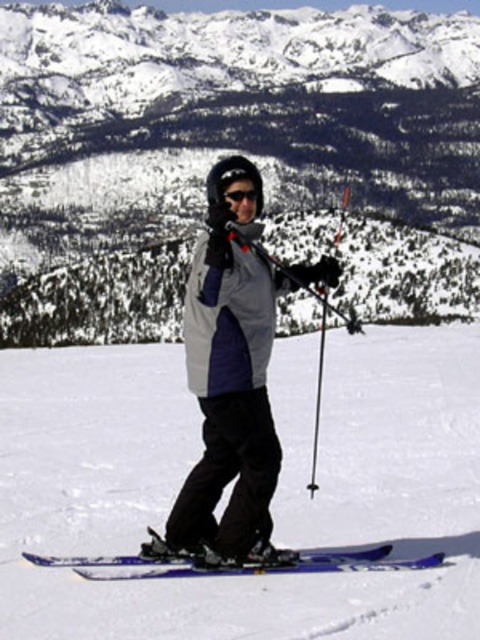
Is blue metallic skis at center shorter than black matte goggles at center?

Incorrect, blue metallic skis at center's height does not fall short of black matte goggles at center's.

This screenshot has width=480, height=640. Describe the element at coordinates (274, 497) in the screenshot. I see `blue metallic skis at center` at that location.

This screenshot has height=640, width=480. In order to click on blue metallic skis at center in this screenshot , I will do (274, 497).

Which is behind, point (420, 547) or point (103, 561)?

The point (420, 547) is more distant.

Does point (386, 348) lie behind point (328, 557)?

Yes, point (386, 348) is behind point (328, 557).

Is point (196, 611) more distant than point (208, 572)?

No, (196, 611) is closer to viewer.

At what (x,y) coordinates should I click in order to perform the action: click on blue metallic skis at center. Please return your answer as a coordinate pair (x, y). This screenshot has width=480, height=640. Looking at the image, I should click on (274, 497).

Can you confirm if blue metallic skis at lower center is thinner than black matte goggles at center?

In fact, blue metallic skis at lower center might be wider than black matte goggles at center.

Is point (393, 566) positioned behind point (252, 196)?

No, it is not.

Locate an element on the screen. Image resolution: width=480 pixels, height=640 pixels. blue metallic skis at lower center is located at coordinates (244, 564).